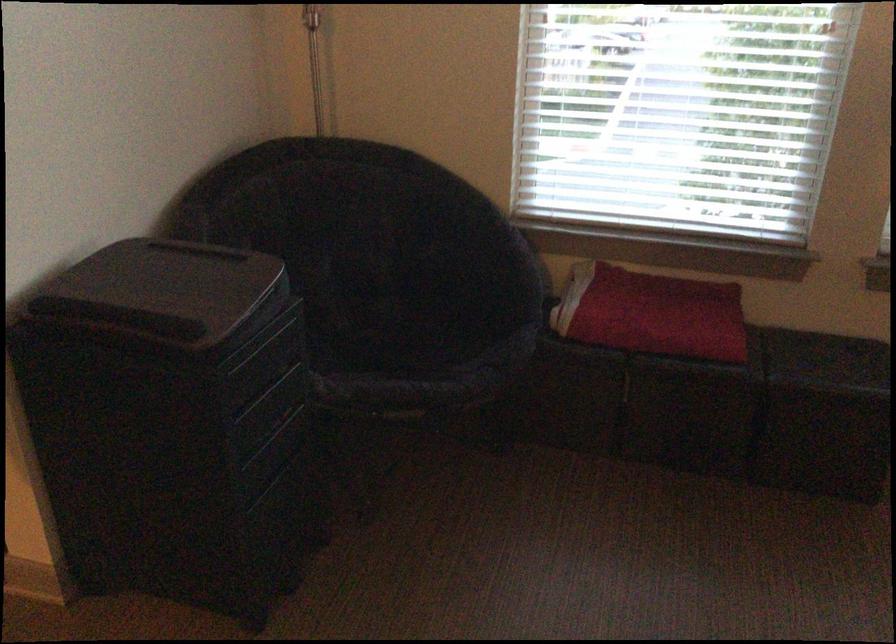
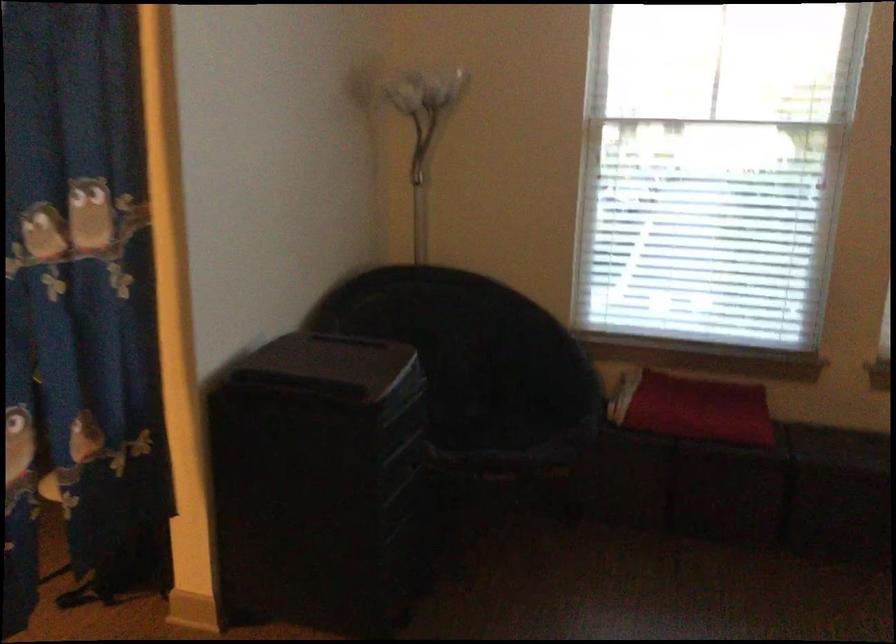
What movement of the cameraman would produce the second image?

The movement direction of the cameraman is left, backward.